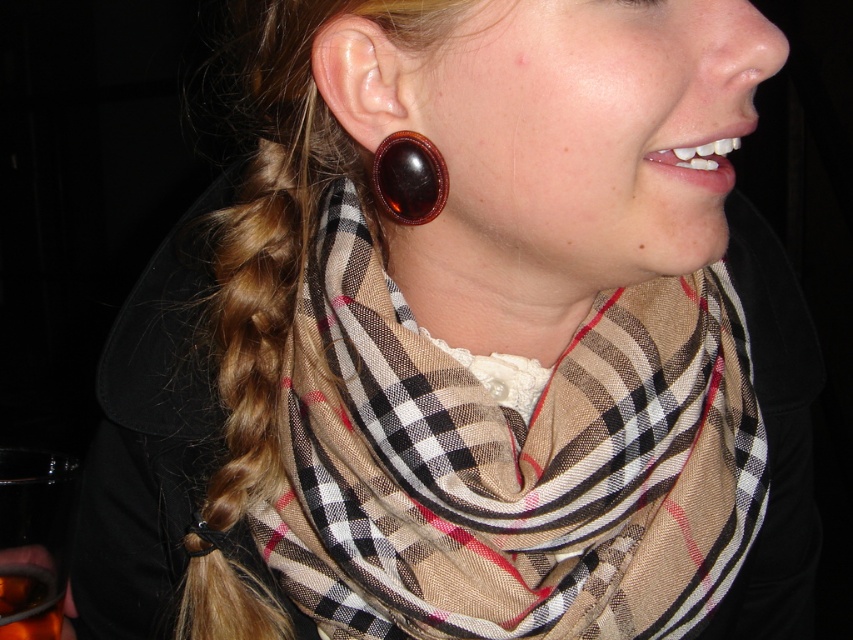
Who is shorter, plaid fabric scarf at center or shiny brown earring at ear?

With less height is shiny brown earring at ear.

Which is behind, point (347, 268) or point (389, 150)?

Point (347, 268)

Where is `plaid fabric scarf at center`? plaid fabric scarf at center is located at coordinates (509, 460).

Which is more to the left, plaid fabric scarf at center or translucent amber liquid at lower left?

From the viewer's perspective, translucent amber liquid at lower left appears more on the left side.

Between point (276, 538) and point (19, 630), which one is positioned behind?

The point (276, 538) is behind.

Does point (280, 444) come farther from viewer compared to point (32, 609)?

Yes, it is.

Locate an element on the screen. Image resolution: width=853 pixels, height=640 pixels. plaid fabric scarf at center is located at coordinates (509, 460).

Is shiny brown earring at ear wider than translucent amber liquid at lower left?

Yes, shiny brown earring at ear is wider than translucent amber liquid at lower left.

Does shiny brown earring at ear come behind translucent amber liquid at lower left?

No, shiny brown earring at ear is closer to the viewer.

Does point (421, 173) lie behind point (12, 595)?

That is False.

Where is `shiny brown earring at ear`? shiny brown earring at ear is located at coordinates (409, 177).